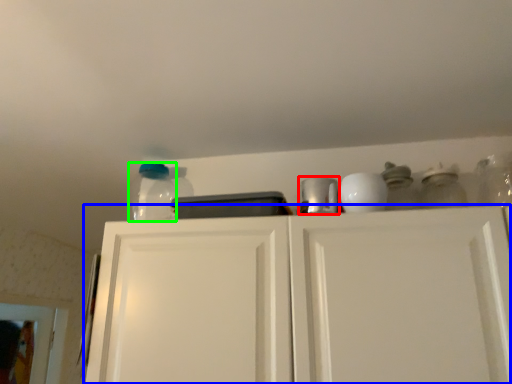
Question: Considering the real-world distances, which object is farthest from appliance (highlighted by a red box)? cabinetry (highlighted by a blue box) or glass jar (highlighted by a green box)?

Choices:
 (A) cabinetry
 (B) glass jar

Answer: (B)